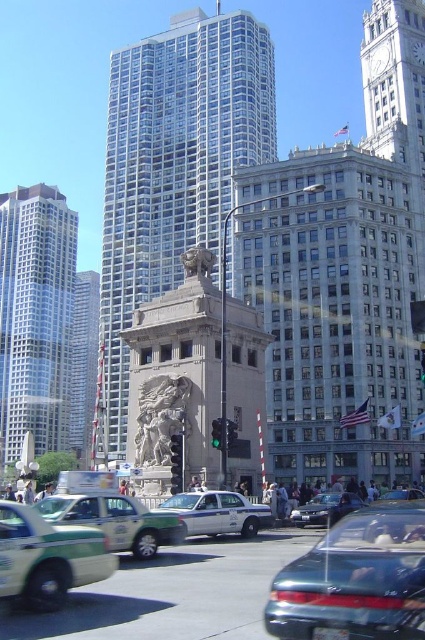
Based on the photo, can you confirm if glassy steel skyscraper at center is taller than gray stone lion statue at center?

Yes, glassy steel skyscraper at center is taller than gray stone lion statue at center.

Is glassy steel skyscraper at center thinner than gray stone lion statue at center?

No.

What do you see at coordinates (172, 170) in the screenshot? The image size is (425, 640). I see `glassy steel skyscraper at center` at bounding box center [172, 170].

Identify the location of glassy steel skyscraper at center. The image size is (425, 640). (172, 170).

Based on the photo, who is more distant from viewer, (37, 557) or (73, 522)?

The point (73, 522) is more distant.

Is green matte taxi at lower left thinner than green matte taxi cab at lower left?

Indeed, green matte taxi at lower left has a lesser width compared to green matte taxi cab at lower left.

Is point (11, 540) more distant than point (172, 531)?

No, (11, 540) is in front of (172, 531).

Identify the location of green matte taxi at lower left. (48, 557).

Can you confirm if glassy steel skyscraper at center is shorter than white glossy taxi at center?

In fact, glassy steel skyscraper at center may be taller than white glossy taxi at center.

Between glassy steel skyscraper at center and white glossy taxi at center, which one is positioned lower?

white glossy taxi at center

Is point (218, 76) farther from camera compared to point (240, 512)?

Yes, it is behind point (240, 512).

Find the location of a particular element. glassy steel skyscraper at center is located at coordinates coord(172,170).